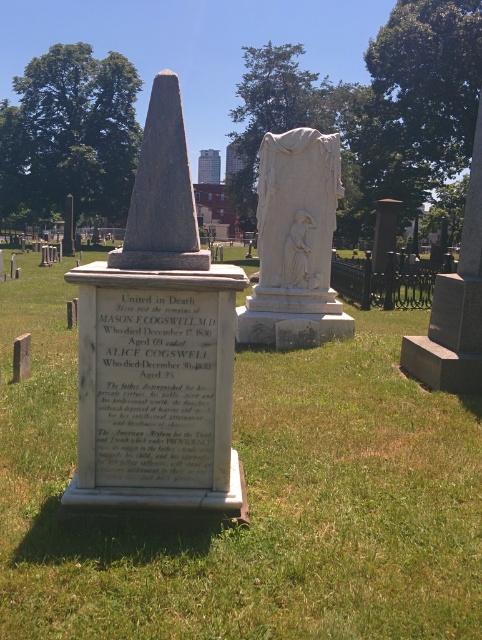
In the scene shown: You are a gardener tasked with trimming the green grass at center and the white marble statue at center. Which object requires more attention in terms of height adjustment?

The white marble statue at center is taller than the green grass at center, so the gardener should focus on trimming the green grass at center to match the statue or adjust accordingly based on the desired height.

You are a groundskeeper planning to place a new flowerpot between the green grass at center and the white marble statue at center. Since you want the flowerpot to be centered between them, which object should you use as a reference point to ensure proper alignment?

The green grass at center is wider than the white marble statue at center. To center the flowerpot between them, align it with the midpoint of the green grass at center since it occupies more space horizontally.

You are a gardener planning to place a new flowerpot between the green grass at center and the smooth gray stone monument at center. Based on their widths, which object should the flowerpot be closer to?

The green grass at center is wider than the smooth gray stone monument at center, so the flowerpot should be placed closer to the smooth gray stone monument at center to ensure proper spacing between the two objects.